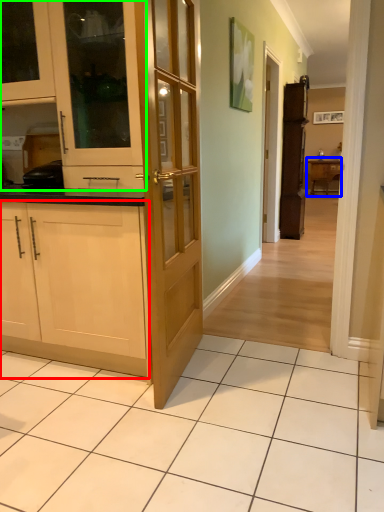
Question: Which is nearer to the cabinetry (highlighted by a red box)? table (highlighted by a blue box) or cabinetry (highlighted by a green box).

Choices:
 (A) table
 (B) cabinetry

Answer: (B)